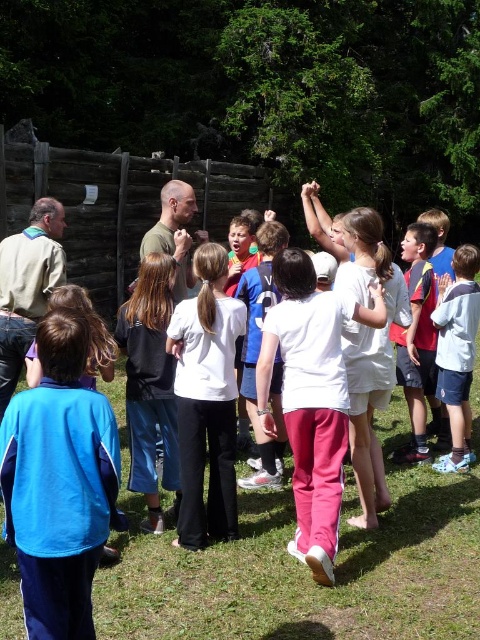
The image size is (480, 640). What do you see at coordinates (59, 483) in the screenshot? I see `blue fabric jacket at lower left` at bounding box center [59, 483].

The height and width of the screenshot is (640, 480). Identify the location of blue fabric jacket at lower left. (59, 483).

Is point (153, 524) in front of point (454, 323)?

Yes, point (153, 524) is in front of point (454, 323).

The image size is (480, 640). In order to click on black fabric jacket at center in this screenshot , I will do `click(149, 385)`.

The image size is (480, 640). What are the coordinates of `black fabric jacket at center` in the screenshot? It's located at (149, 385).

Describe the element at coordinates (59, 483) in the screenshot. I see `blue fabric jacket at lower left` at that location.

Is blue fabric jacket at lower left below white matte shirt at center?

Yes.

Locate an element on the screen. blue fabric jacket at lower left is located at coordinates [59, 483].